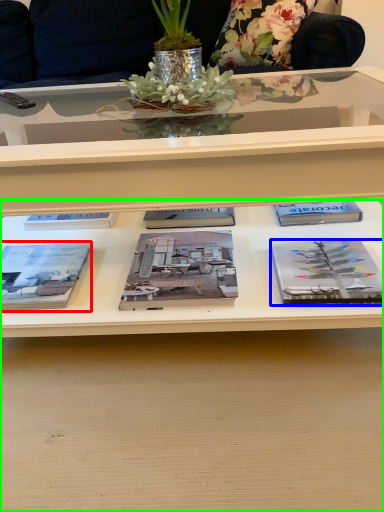
Question: Which object is the farthest from book (highlighted by a red box)? Choose among these: book (highlighted by a blue box) or desk (highlighted by a green box).

Choices:
 (A) book
 (B) desk

Answer: (A)